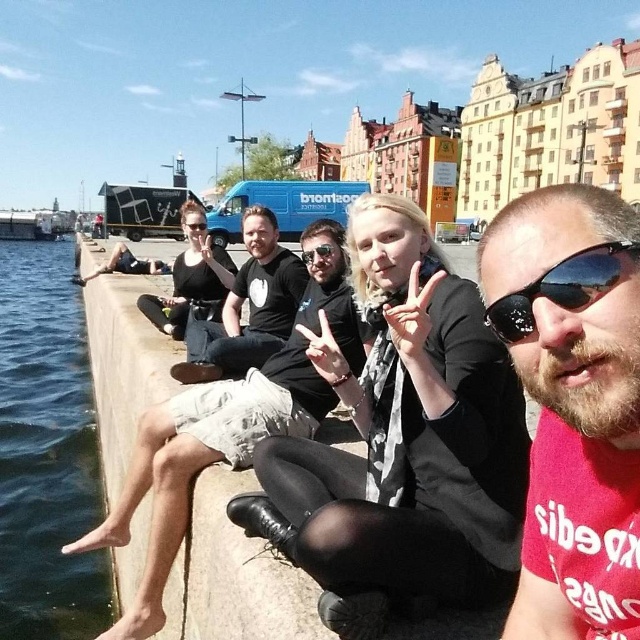
You are a photographer trying to capture a closeup shot of the light beige shorts at center and the black reflective sunglasses at center. Which object should you zoom in on to ensure both are in focus without moving the camera?

The light beige shorts at center is larger in size than the black reflective sunglasses at center, so you should zoom in on the smaller object, the black reflective sunglasses at center, to ensure both are in focus without moving the camera.